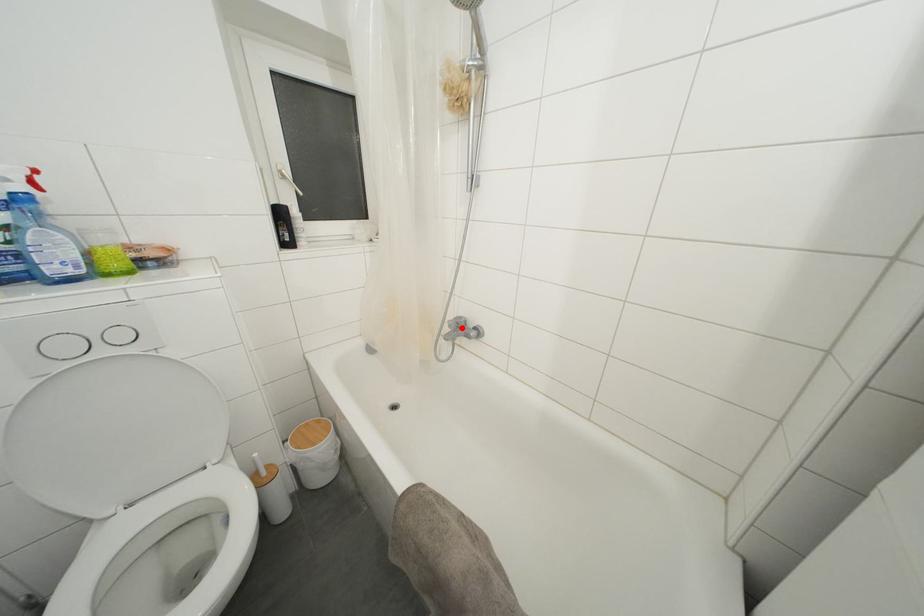
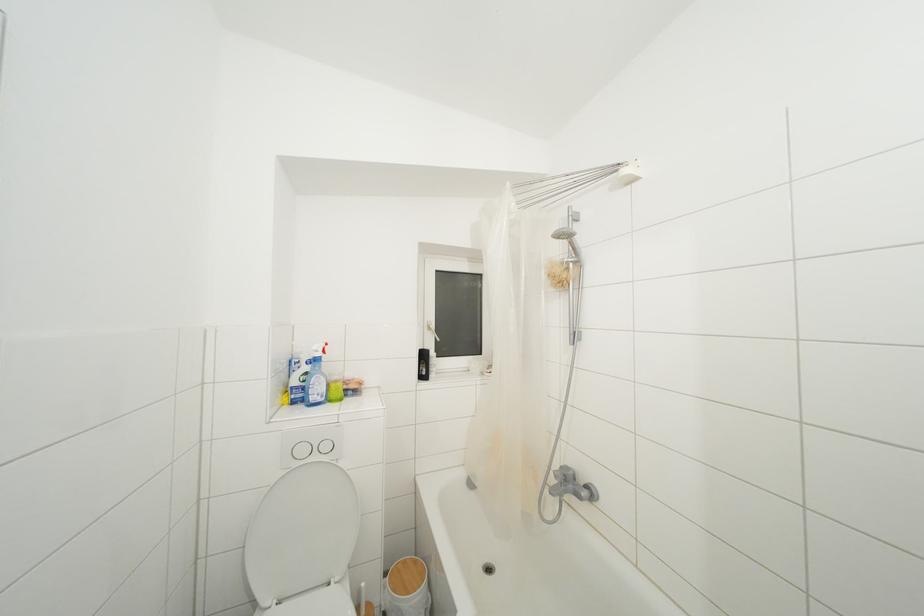
Question: I am providing you with two images of the same scene from different viewpoints. A red point is shown in image1. For the corresponding object point in image2, is it positioned nearer or farther from the camera?

Choices:
 (A) Nearer
 (B) Farther

Answer: (B)